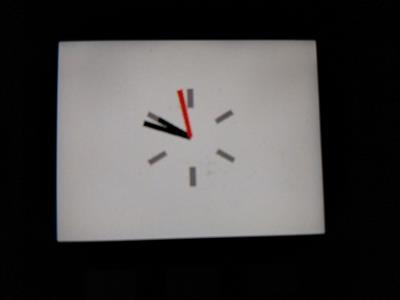
Where is `the bottom left corner of white clock`? The width and height of the screenshot is (400, 300). the bottom left corner of white clock is located at coordinates (57, 242).